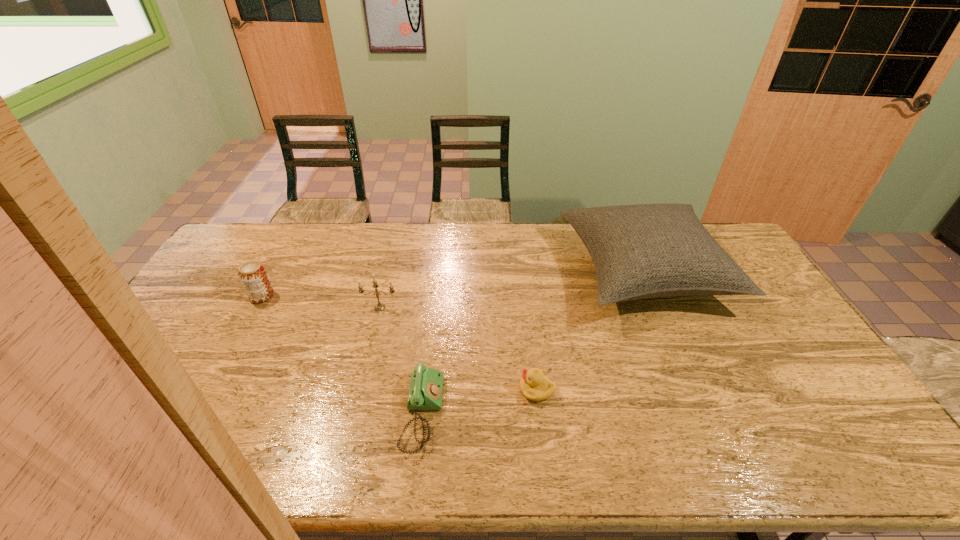
Where is `free space between the telephone and the fourth object from left to right`? The height and width of the screenshot is (540, 960). free space between the telephone and the fourth object from left to right is located at coordinates (480, 401).

Identify which object is located as the third nearest to the third object from left to right. Please provide its 2D coordinates. Your answer should be formatted as a tuple, i.e. [(x, y)], where the tuple contains the x and y coordinates of a point satisfying the conditions above.

[(641, 251)]

Choose which object is the fourth nearest neighbor to the second object from left to right. Please provide its 2D coordinates. Your answer should be formatted as a tuple, i.e. [(x, y)], where the tuple contains the x and y coordinates of a point satisfying the conditions above.

[(641, 251)]

What are the coordinates of `free location that satisfies the following two spatial constraints: 1. on the back side of the cushion; 2. on the right side of the fourth object from right to left` in the screenshot? It's located at (389, 272).